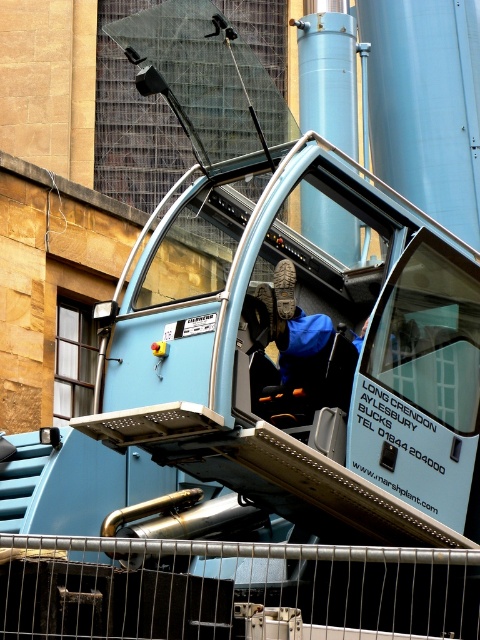
You are a safety inspector checking the crane cab. You notice the metal at lower center and the blue fabric jacket at center. According to safety protocols, which object should be accessible without obstruction? Please explain your reasoning based on their positions.

The metal at lower center should be accessible without obstruction because it is positioned in front of the blue fabric jacket at center, ensuring clear access for safety checks.

You are a safety inspector standing at the crane operator seat. You need to reach both the metal at lower center and the blue fabric jacket at center during an inspection. Given that your arm can only extend 1.5 meters, can you comfortably reach both objects without moving your position?

The metal at lower center is 4.65 meters away from blue fabric jacket at center. Since your arm can only extend 1.5 meters, you cannot comfortably reach both objects without moving your position because the distance between them exceeds your arm reach.

You are standing in front of the crane cab and see the point at coordinates (x=232, y=589). Which part of the crane cab is this point located on?

The point at coordinates (x=232, y=589) is located on the metal at lower center of the crane cab.